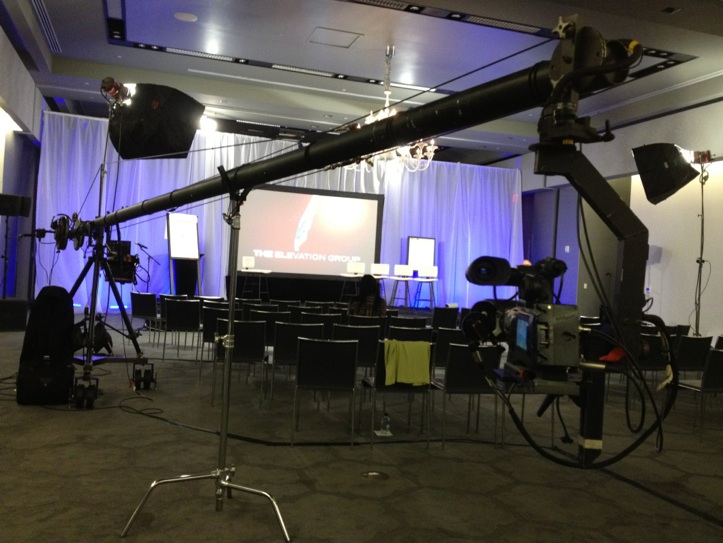
Identify the location of light. (402, 157).